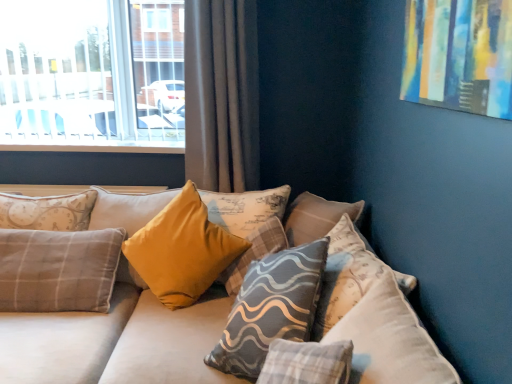
What is the approximate width of velvet mustard pillow at center, the second pillow positioned from the right?

Result: It is 13.96 inches.

The image size is (512, 384). Describe the element at coordinates (254, 253) in the screenshot. I see `gray textured pillow at center, marked as the 2th pillow in a left-to-right arrangement` at that location.

The height and width of the screenshot is (384, 512). I want to click on velvet mustard pillow at center, the second pillow positioned from the right, so click(x=271, y=308).

Considering the sizes of velvet beige couch at center and velvet mustard pillow at center, the second pillow positioned from the right, in the image, is velvet beige couch at center wider or thinner than velvet mustard pillow at center, the second pillow positioned from the right,?

velvet beige couch at center is wider than velvet mustard pillow at center, the second pillow positioned from the right.

Would you say velvet beige couch at center is a long distance from velvet mustard pillow at center, the second pillow positioned from the right?

No, velvet beige couch at center is not far from velvet mustard pillow at center, the second pillow positioned from the right.

From the image's perspective, is velvet beige couch at center above or below velvet mustard pillow at center, which is the third pillow in left-to-right order?

velvet beige couch at center is below velvet mustard pillow at center, which is the third pillow in left-to-right order.

Starting from the velvet beige couch at center, which pillow is the 3rd one to the right? Please provide its 2D coordinates.

[(271, 308)]

Is gray fabric curtain at upper left further to camera compared to velvet beige couch at center?

Yes, gray fabric curtain at upper left is further from the viewer.

Is point (237, 157) behind point (369, 302)?

Yes, point (237, 157) is behind point (369, 302).

From a real-world perspective, which is physically above, gray fabric curtain at upper left or velvet beige couch at center?

gray fabric curtain at upper left.

Is gray fabric curtain at upper left aimed at velvet beige couch at center?

No, gray fabric curtain at upper left does not turn towards velvet beige couch at center.

Looking at this image, which is more to the right, clear glass window at upper left or gray textured pillow at center, marked as the 1th pillow in a right-to-left arrangement?

gray textured pillow at center, marked as the 1th pillow in a right-to-left arrangement.

Is clear glass window at upper left wider than gray textured pillow at center, marked as the 1th pillow in a right-to-left arrangement?

In fact, clear glass window at upper left might be narrower than gray textured pillow at center, marked as the 1th pillow in a right-to-left arrangement.

From the image's perspective, would you say clear glass window at upper left is shown under gray textured pillow at center, acting as the fourth pillow starting from the left?

Actually, clear glass window at upper left appears above gray textured pillow at center, acting as the fourth pillow starting from the left, in the image.

From a real-world perspective, is clear glass window at upper left positioned under gray textured pillow at center, marked as the 1th pillow in a right-to-left arrangement, based on gravity?

No, from a real-world perspective, clear glass window at upper left is not under gray textured pillow at center, marked as the 1th pillow in a right-to-left arrangement.

Which is closer to the camera, (246, 251) or (189, 66)?

Positioned in front is point (246, 251).

From the image's perspective, who appears lower, gray textured pillow at center, marked as the 2th pillow in a left-to-right arrangement, or gray fabric curtain at upper left?

From the image's view, gray textured pillow at center, marked as the 2th pillow in a left-to-right arrangement, is below.

Is gray textured pillow at center, the third pillow positioned from the right, not close to gray fabric curtain at upper left?

gray textured pillow at center, the third pillow positioned from the right, is near gray fabric curtain at upper left, not far away.

From a real-world perspective, which object stands above the other?

gray fabric curtain at upper left, from a real-world perspective.

Considering the positions of point (381, 289) and point (147, 199), is point (381, 289) closer or farther from the camera than point (147, 199)?

Point (381, 289).

Who is shorter, velvet beige couch at center or yellow fabric pillow at center, placed as the 1th pillow when sorted from left to right?

yellow fabric pillow at center, placed as the 1th pillow when sorted from left to right, is shorter.

Is yellow fabric pillow at center, the 4th pillow viewed from the right, surrounded by velvet beige couch at center?

Indeed, yellow fabric pillow at center, the 4th pillow viewed from the right, is located within velvet beige couch at center.

From the image's perspective, is velvet beige couch at center positioned above or below yellow fabric pillow at center, the 4th pillow viewed from the right?

From the image's perspective, velvet beige couch at center appears below yellow fabric pillow at center, the 4th pillow viewed from the right.

Which is closer, (351,337) or (197,89)?

Point (351,337)

Which object is further away from the camera taking this photo, velvet beige couch at center or gray fabric curtain at upper left?

gray fabric curtain at upper left is further away from the camera.

Considering the sizes of objects velvet beige couch at center and gray fabric curtain at upper left in the image provided, who is taller, velvet beige couch at center or gray fabric curtain at upper left?

gray fabric curtain at upper left.

Locate an element on the screen. This screenshot has width=512, height=384. studio couch below the gray fabric curtain at upper left (from the image's perspective) is located at coordinates (98, 293).

Is gray fabric curtain at upper left turned away from velvet mustard pillow at center, which is the third pillow in left-to-right order?

gray fabric curtain at upper left does not have its back to velvet mustard pillow at center, which is the third pillow in left-to-right order.

From a real-world perspective, who is located lower, gray fabric curtain at upper left or velvet mustard pillow at center, which is the third pillow in left-to-right order?

velvet mustard pillow at center, which is the third pillow in left-to-right order, is physically lower.

Based on the photo, can you see gray fabric curtain at upper left touching velvet mustard pillow at center, which is the third pillow in left-to-right order?

gray fabric curtain at upper left and velvet mustard pillow at center, which is the third pillow in left-to-right order, are not in contact.

Choose the correct answer: Is gray fabric curtain at upper left inside velvet mustard pillow at center, which is the third pillow in left-to-right order, or outside it?

gray fabric curtain at upper left cannot be found inside velvet mustard pillow at center, which is the third pillow in left-to-right order.

Identify the location of the 2nd pillow positioned above the velvet beige couch at center (from a real-world perspective). This screenshot has width=512, height=384. (271, 308).

Image resolution: width=512 pixels, height=384 pixels. Find the location of `studio couch in front of the gray fabric curtain at upper left`. studio couch in front of the gray fabric curtain at upper left is located at coordinates (98, 293).

Estimate the real-world distances between objects in this image. Which object is further from clear glass window at upper left, velvet mustard pillow at center, which is the third pillow in left-to-right order, or velvet beige couch at center?

The object further to clear glass window at upper left is velvet mustard pillow at center, which is the third pillow in left-to-right order.

Considering their positions, is velvet mustard pillow at center, the second pillow positioned from the right, positioned further to yellow fabric pillow at center, placed as the 1th pillow when sorted from left to right, than velvet beige couch at center?

Among the two, velvet mustard pillow at center, the second pillow positioned from the right, is located further to yellow fabric pillow at center, placed as the 1th pillow when sorted from left to right.

When comparing their distances from velvet beige couch at center, does yellow fabric pillow at center, placed as the 1th pillow when sorted from left to right, or gray textured pillow at center, acting as the fourth pillow starting from the left, seem closer?

yellow fabric pillow at center, placed as the 1th pillow when sorted from left to right, is closer to velvet beige couch at center.

Which object lies nearer to the anchor point clear glass window at upper left, yellow fabric pillow at center, the 4th pillow viewed from the right, or gray textured pillow at center, marked as the 2th pillow in a left-to-right arrangement?

yellow fabric pillow at center, the 4th pillow viewed from the right, is closer to clear glass window at upper left.

Looking at the image, which one is located further to gray fabric curtain at upper left, velvet beige couch at center or gray textured pillow at center, acting as the fourth pillow starting from the left?

Based on the image, gray textured pillow at center, acting as the fourth pillow starting from the left, appears to be further to gray fabric curtain at upper left.

Which object lies nearer to the anchor point gray textured pillow at center, acting as the fourth pillow starting from the left, gray textured pillow at center, marked as the 2th pillow in a left-to-right arrangement, or clear glass window at upper left?

The object closer to gray textured pillow at center, acting as the fourth pillow starting from the left, is gray textured pillow at center, marked as the 2th pillow in a left-to-right arrangement.

Based on their spatial positions, is velvet beige couch at center or clear glass window at upper left further from gray fabric curtain at upper left?

Among the two, velvet beige couch at center is located further to gray fabric curtain at upper left.

Considering their positions, is yellow fabric pillow at center, the 4th pillow viewed from the right, positioned closer to gray textured pillow at center, marked as the 2th pillow in a left-to-right arrangement, than velvet mustard pillow at center, the second pillow positioned from the right?

The object closer to gray textured pillow at center, marked as the 2th pillow in a left-to-right arrangement, is velvet mustard pillow at center, the second pillow positioned from the right.

The height and width of the screenshot is (384, 512). Identify the location of pillow between clear glass window at upper left and gray textured pillow at center, the third pillow positioned from the right, from top to bottom. (127, 209).

Image resolution: width=512 pixels, height=384 pixels. In order to click on curtain between clear glass window at upper left and yellow fabric pillow at center, the 4th pillow viewed from the right, in the up-down direction in this screenshot , I will do (222, 95).

Where is `curtain located between velvet mustard pillow at center, the second pillow positioned from the right, and yellow fabric pillow at center, placed as the 1th pillow when sorted from left to right, in the depth direction`? curtain located between velvet mustard pillow at center, the second pillow positioned from the right, and yellow fabric pillow at center, placed as the 1th pillow when sorted from left to right, in the depth direction is located at coordinates (222, 95).

Identify the location of curtain between velvet beige couch at center and clear glass window at upper left in the front-back direction. Image resolution: width=512 pixels, height=384 pixels. (222, 95).